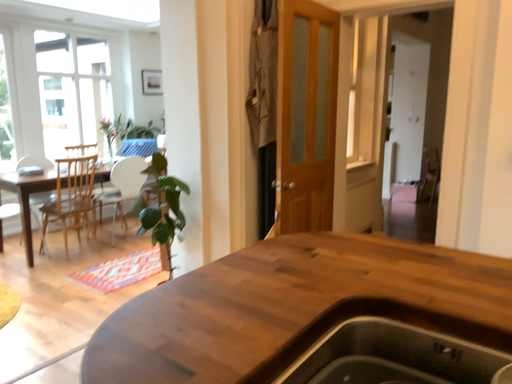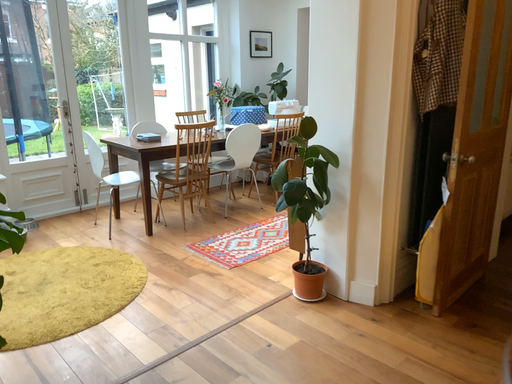
Question: Which way did the camera rotate in the video?

Choices:
 (A) rotated left
 (B) rotated right

Answer: (A)